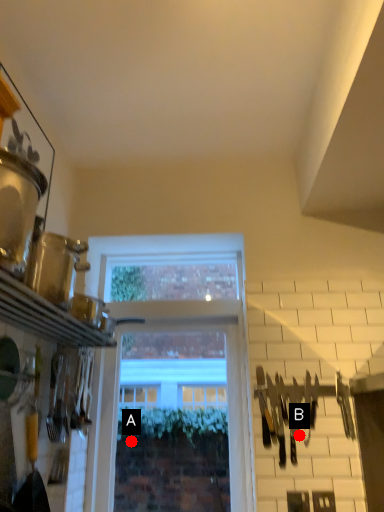
Question: Two points are circled on the image, labeled by A and B beside each circle. Which point appears closest to the camera in this image?

Choices:
 (A) A is closer
 (B) B is closer

Answer: (B)